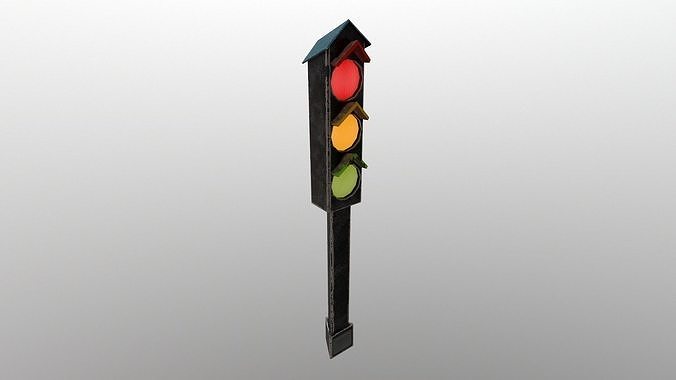
The width and height of the screenshot is (676, 380). What are the coordinates of `covers on lights` in the screenshot? It's located at coord(349,157), coord(354,101), coord(352,43).